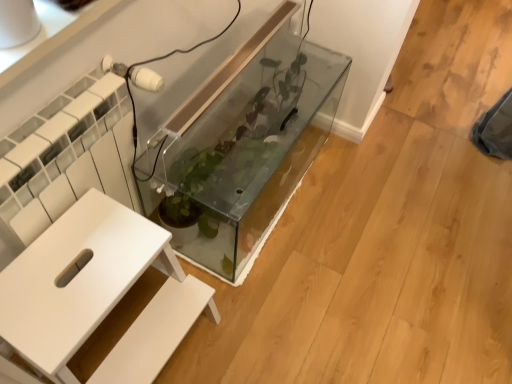
At what (x,y) coordinates should I click in order to perform the action: click on free area below transparent glass tank at center (from a real-world perspective). Please return your answer as a coordinate pair (x, y). Looking at the image, I should click on (266, 201).